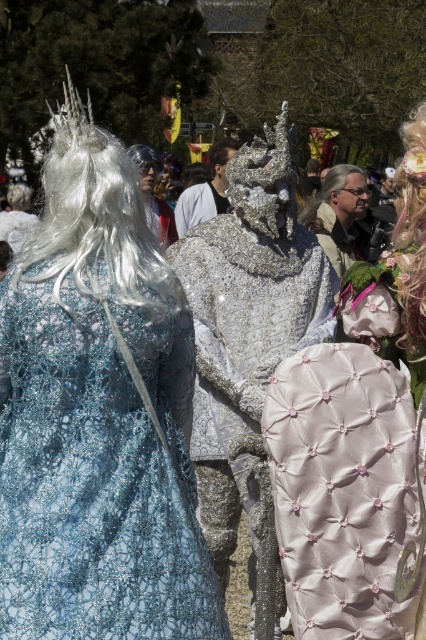
Which is below, shiny silver armor at center or white glittery wig at upper left?

Positioned lower is shiny silver armor at center.

Is shiny silver armor at center wider than white glittery wig at upper left?

Yes.

I want to click on shiny silver armor at center, so click(x=249, y=346).

Between point (186, 588) and point (230, 256), which one is positioned behind?

The point (230, 256) is more distant.

Describe the element at coordinates (97, 416) in the screenshot. I see `glittery blue dress at upper left` at that location.

You are a GUI agent. You are given a task and a screenshot of the screen. Output one action in this format:
    pyautogui.click(x=<x>, y=<y>)
    Task: Click on the glittery blue dress at upper left
    This screenshot has width=426, height=640.
    Given the screenshot: What is the action you would take?
    pyautogui.click(x=97, y=416)

Is shiny silver armor at center closer to the viewer compared to shiny blonde wig at right?

No, shiny silver armor at center is behind shiny blonde wig at right.

The height and width of the screenshot is (640, 426). What do you see at coordinates (249, 346) in the screenshot?
I see `shiny silver armor at center` at bounding box center [249, 346].

Locate an element on the screen. shiny silver armor at center is located at coordinates (249, 346).